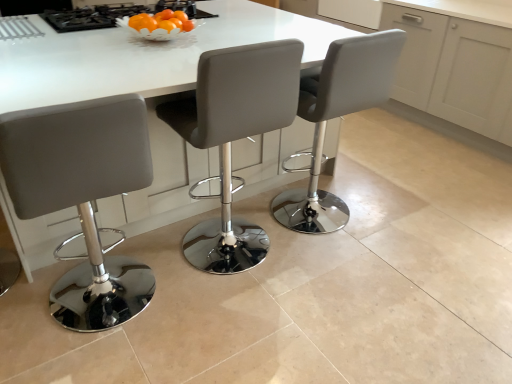
The width and height of the screenshot is (512, 384). Describe the element at coordinates (147, 88) in the screenshot. I see `white glossy table at center` at that location.

Where is `matte gray stool at center, marked as the 3th chair in a right-to-left arrangement`? matte gray stool at center, marked as the 3th chair in a right-to-left arrangement is located at coordinates (83, 195).

This screenshot has height=384, width=512. What do you see at coordinates (352, 11) in the screenshot?
I see `white matte cabinet at upper center` at bounding box center [352, 11].

What do you see at coordinates (335, 117) in the screenshot? I see `white leather stool at center, placed as the third chair when sorted from left to right` at bounding box center [335, 117].

Identify the location of white leather stool at center, the first chair from the right. Image resolution: width=512 pixels, height=384 pixels. (335, 117).

The width and height of the screenshot is (512, 384). I want to click on matte gray stool at center, the 2th chair when ordered from left to right, so (x=234, y=137).

Identify the location of black glass gas stove at upper center. (114, 15).

From a real-world perspective, which object stands above the other?

black glass gas stove at upper center.

From the picture: From the image's perspective, is white glossy table at center located beneath black glass gas stove at upper center?

Correct, white glossy table at center appears lower than black glass gas stove at upper center in the image.

Would you consider white glossy table at center to be distant from black glass gas stove at upper center?

Actually, white glossy table at center and black glass gas stove at upper center are a little close together.

Does white glossy table at center have a lesser height compared to black glass gas stove at upper center?

Incorrect, the height of white glossy table at center does not fall short of that of black glass gas stove at upper center.

Which of these two, white matte cabinet at upper center or matte gray stool at center, the 2th chair when ordered from left to right, stands shorter?

white matte cabinet at upper center is shorter.

Is point (370, 25) closer to camera compared to point (208, 267)?

That is False.

Who is smaller, white matte cabinet at upper center or matte gray stool at center, the 2th chair when ordered from right to left?

white matte cabinet at upper center is smaller.

From the image's perspective, count 2nd chairs downward from the black glass gas stove at upper center and point to it. Please provide its 2D coordinates.

[(234, 137)]

Can you confirm if black glass gas stove at upper center is smaller than matte gray stool at center, the 2th chair when ordered from left to right?

Yes, black glass gas stove at upper center is smaller than matte gray stool at center, the 2th chair when ordered from left to right.

Can you see black glass gas stove at upper center touching matte gray stool at center, the 2th chair when ordered from right to left?

black glass gas stove at upper center and matte gray stool at center, the 2th chair when ordered from right to left, are not in contact.

From a real-world perspective, who is located lower, matte gray stool at center, marked as the 3th chair in a right-to-left arrangement, or white matte cabinet at upper center?

matte gray stool at center, marked as the 3th chair in a right-to-left arrangement.

Considering the sizes of matte gray stool at center, acting as the first chair starting from the left, and white matte cabinet at upper center in the image, is matte gray stool at center, acting as the first chair starting from the left, wider or thinner than white matte cabinet at upper center?

Considering their sizes, matte gray stool at center, acting as the first chair starting from the left, looks broader than white matte cabinet at upper center.

Is matte gray stool at center, marked as the 3th chair in a right-to-left arrangement, facing towards white matte cabinet at upper center?

No, matte gray stool at center, marked as the 3th chair in a right-to-left arrangement, does not turn towards white matte cabinet at upper center.

How many degrees apart are the facing directions of matte gray stool at center, marked as the 3th chair in a right-to-left arrangement, and white matte cabinet at upper center?

91.4 degrees separate the facing orientations of matte gray stool at center, marked as the 3th chair in a right-to-left arrangement, and white matte cabinet at upper center.

Which of these two, white matte cabinet at upper center or white leather stool at center, the first chair from the right, is wider?

white leather stool at center, the first chair from the right.

Considering the relative positions of white matte cabinet at upper center and white leather stool at center, the first chair from the right, in the image provided, is white matte cabinet at upper center to the left or to the right of white leather stool at center, the first chair from the right,?

Based on their positions, white matte cabinet at upper center is located to the right of white leather stool at center, the first chair from the right.

Is white matte cabinet at upper center far away from white leather stool at center, placed as the third chair when sorted from left to right?

Yes.

In terms of height, does white matte cabinet at upper center look taller or shorter compared to white leather stool at center, placed as the third chair when sorted from left to right?

In the image, white matte cabinet at upper center appears to be shorter than white leather stool at center, placed as the third chair when sorted from left to right.

Is point (357, 12) in front of point (86, 17)?

No.

From the image's perspective, between white matte cabinet at upper center and black glass gas stove at upper center, which one is located above?

white matte cabinet at upper center, from the image's perspective.

Does white matte cabinet at upper center lie behind black glass gas stove at upper center?

Yes, white matte cabinet at upper center is further from the camera.

Identify the location of gas stove to the left of white matte cabinet at upper center. The height and width of the screenshot is (384, 512). (114, 15).

This screenshot has width=512, height=384. What are the coordinates of `cabinetry located behind the white glossy table at center` in the screenshot? It's located at (352, 11).

Could you tell me if white glossy table at center is turned towards white matte cabinet at upper center?

No, white glossy table at center is not turned towards white matte cabinet at upper center.

From the image's perspective, does white glossy table at center appear lower than white matte cabinet at upper center?

Yes, from the image's perspective, white glossy table at center is beneath white matte cabinet at upper center.

Is white glossy table at center behind white matte cabinet at upper center?

No, white glossy table at center is in front of white matte cabinet at upper center.

The image size is (512, 384). Identify the location of kitchen & dining room table in front of the black glass gas stove at upper center. (147, 88).

Identify the location of chair that is the 2nd one when counting leftward from the white matte cabinet at upper center. Image resolution: width=512 pixels, height=384 pixels. (234, 137).

Looking at the image, which one is located closer to white matte cabinet at upper center, white leather stool at center, the first chair from the right, or matte gray stool at center, marked as the 3th chair in a right-to-left arrangement?

white leather stool at center, the first chair from the right, is positioned closer to the anchor white matte cabinet at upper center.

From the image, which object appears to be nearer to black glass gas stove at upper center, matte gray stool at center, the 2th chair when ordered from right to left, or white matte cabinet at upper center?

matte gray stool at center, the 2th chair when ordered from right to left, is positioned closer to the anchor black glass gas stove at upper center.

Looking at the image, which one is located closer to white glossy table at center, matte gray stool at center, the 2th chair when ordered from right to left, or matte gray stool at center, acting as the first chair starting from the left?

matte gray stool at center, the 2th chair when ordered from right to left, is positioned closer to the anchor white glossy table at center.

Which object lies further to the anchor point matte gray stool at center, acting as the first chair starting from the left, matte gray stool at center, the 2th chair when ordered from right to left, or white leather stool at center, placed as the third chair when sorted from left to right?

white leather stool at center, placed as the third chair when sorted from left to right, lies further to matte gray stool at center, acting as the first chair starting from the left, than the other object.

When comparing their distances from white leather stool at center, placed as the third chair when sorted from left to right, does black glass gas stove at upper center or matte gray stool at center, acting as the first chair starting from the left, seem closer?

Based on the image, matte gray stool at center, acting as the first chair starting from the left, appears to be nearer to white leather stool at center, placed as the third chair when sorted from left to right.

When comparing their distances from white matte cabinet at upper center, does white leather stool at center, placed as the third chair when sorted from left to right, or matte gray stool at center, the 2th chair when ordered from right to left, seem closer?

Based on the image, white leather stool at center, placed as the third chair when sorted from left to right, appears to be nearer to white matte cabinet at upper center.

Based on their spatial positions, is black glass gas stove at upper center or white matte cabinet at upper center further from matte gray stool at center, the 2th chair when ordered from left to right?

white matte cabinet at upper center lies further to matte gray stool at center, the 2th chair when ordered from left to right, than the other object.

When comparing their distances from black glass gas stove at upper center, does matte gray stool at center, the 2th chair when ordered from right to left, or white leather stool at center, the first chair from the right, seem closer?

matte gray stool at center, the 2th chair when ordered from right to left, lies closer to black glass gas stove at upper center than the other object.

You are a GUI agent. You are given a task and a screenshot of the screen. Output one action in this format:
    pyautogui.click(x=<x>, y=<y>)
    Task: Click on the gas stove between white glossy table at center and white matte cabinet at upper center in the front-back direction
    Image resolution: width=512 pixels, height=384 pixels.
    Given the screenshot: What is the action you would take?
    pyautogui.click(x=114, y=15)

This screenshot has height=384, width=512. Identify the location of kitchen & dining room table positioned between matte gray stool at center, marked as the 3th chair in a right-to-left arrangement, and black glass gas stove at upper center from near to far. (147, 88).

What are the coordinates of `gas stove between matte gray stool at center, the 2th chair when ordered from left to right, and white matte cabinet at upper center from front to back` in the screenshot? It's located at (114, 15).

Where is `kitchen & dining room table situated between matte gray stool at center, marked as the 3th chair in a right-to-left arrangement, and white leather stool at center, placed as the third chair when sorted from left to right, from left to right`? kitchen & dining room table situated between matte gray stool at center, marked as the 3th chair in a right-to-left arrangement, and white leather stool at center, placed as the third chair when sorted from left to right, from left to right is located at coordinates (147, 88).